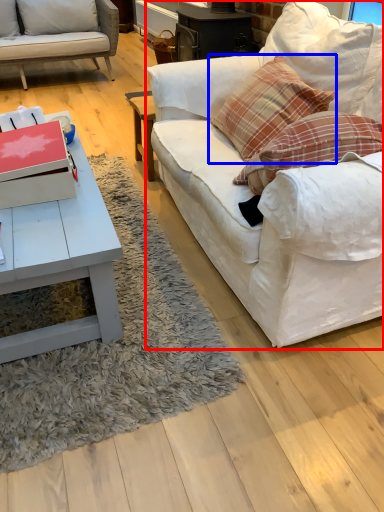
Question: Which of the following is the farthest to the observer, studio couch (highlighted by a red box) or pillow (highlighted by a blue box)?

Choices:
 (A) studio couch
 (B) pillow

Answer: (B)